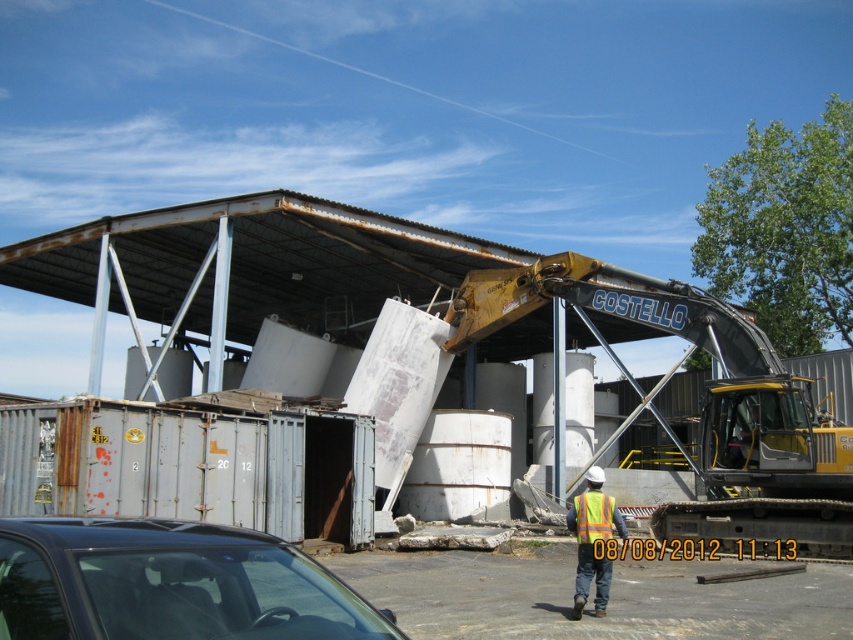
Does yellow reflective vest at center have a smaller size compared to reflective yellow safety vest at center?

Incorrect, yellow reflective vest at center is not smaller in size than reflective yellow safety vest at center.

Can you confirm if yellow reflective vest at center is positioned to the right of reflective yellow safety vest at center?

Correct, you'll find yellow reflective vest at center to the right of reflective yellow safety vest at center.

The height and width of the screenshot is (640, 853). What do you see at coordinates (592, 540) in the screenshot? I see `yellow reflective vest at center` at bounding box center [592, 540].

You are a GUI agent. You are given a task and a screenshot of the screen. Output one action in this format:
    pyautogui.click(x=<x>, y=<y>)
    Task: Click on the yellow reflective vest at center
    Image resolution: width=853 pixels, height=640 pixels.
    Given the screenshot: What is the action you would take?
    pyautogui.click(x=592, y=540)

Is yellow metallic excavator at center taller than black glossy car at lower left?

Yes.

Does point (740, 385) come closer to viewer compared to point (241, 582)?

No, (740, 385) is behind (241, 582).

Image resolution: width=853 pixels, height=640 pixels. Identify the location of yellow metallic excavator at center. (701, 403).

Between yellow metallic excavator at center and yellow reflective vest at center, which one appears on the left side from the viewer's perspective?

Positioned to the left is yellow reflective vest at center.

Can you confirm if yellow metallic excavator at center is bigger than yellow reflective vest at center?

Indeed, yellow metallic excavator at center has a larger size compared to yellow reflective vest at center.

Identify the location of yellow metallic excavator at center. (701, 403).